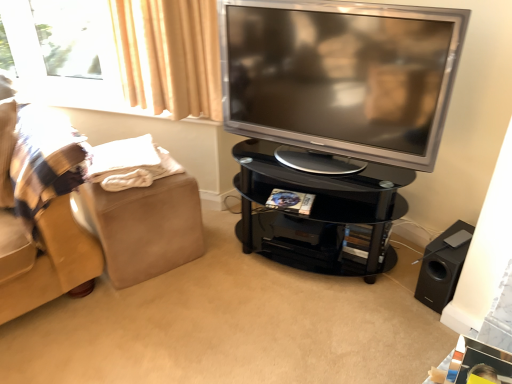
The width and height of the screenshot is (512, 384). What are the coordinates of `vacant area to the left of black glass tv stand at center` in the screenshot? It's located at (201, 276).